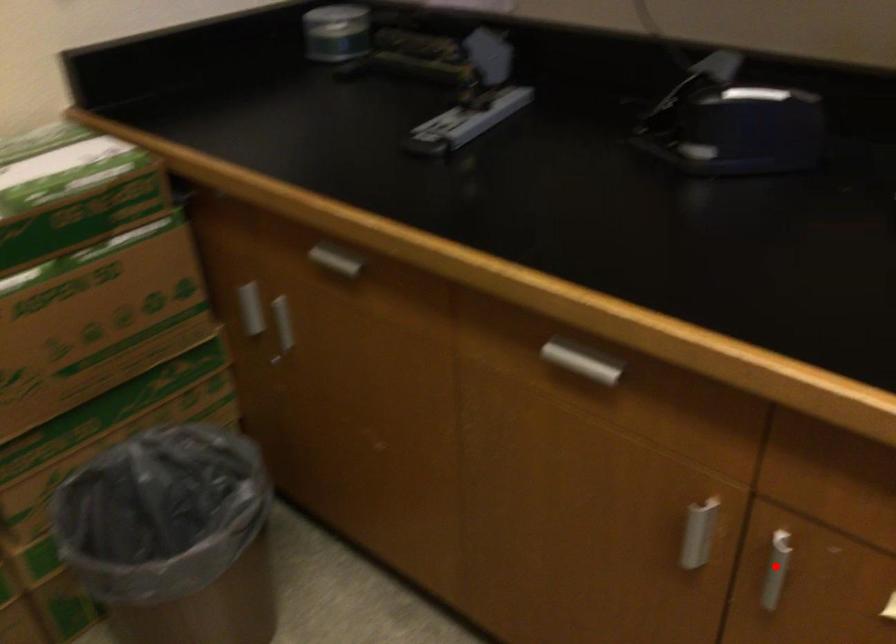
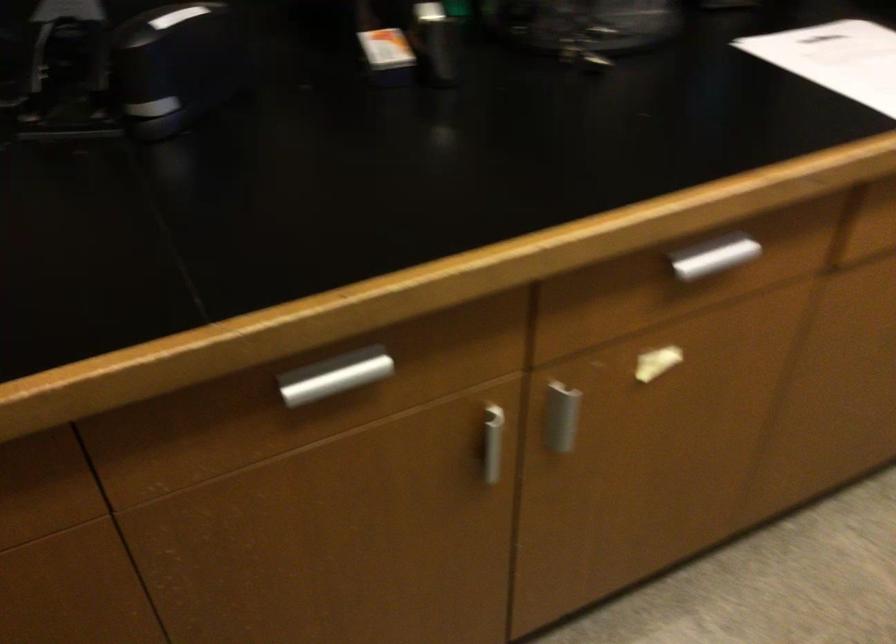
The point at the highlighted location is marked in the first image. Where is the corresponding point in the second image?

(561, 415)